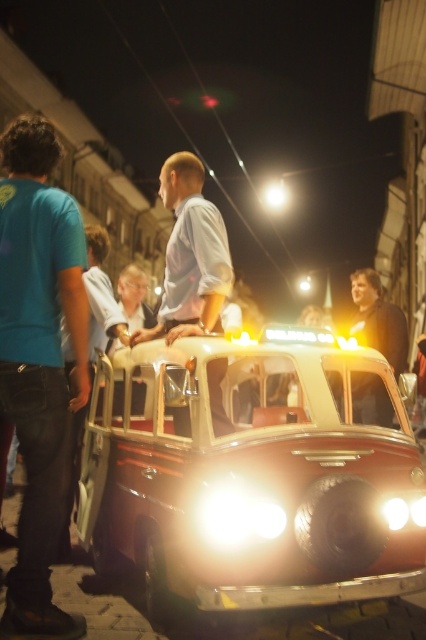
Question: Which of these objects is positioned closest to the matte white shirt at center?

Choices:
 (A) light blue shirt at center
 (B) shiny red car at center
 (C) dark brown leather jacket at upper right
 (D) bright white plastic headlight at center

Answer: (A)

Question: Is light blue shirt at center smaller than bright white plastic headlight at center?

Choices:
 (A) no
 (B) yes

Answer: (A)

Question: Based on their relative distances, which object is farther from the teal t-shirt at left?

Choices:
 (A) glossy plastic headlight at lower center
 (B) light blue shirt at center
 (C) matte white shirt at center

Answer: (A)

Question: Does shiny red car at center appear over teal t-shirt at left?

Choices:
 (A) no
 (B) yes

Answer: (A)

Question: Does light blue shirt at center appear on the right side of glossy plastic headlight at lower center?

Choices:
 (A) yes
 (B) no

Answer: (B)

Question: Among these objects, which one is nearest to the camera?

Choices:
 (A) shiny red car at center
 (B) glossy plastic headlight at lower center
 (C) light blue shirt at center

Answer: (A)